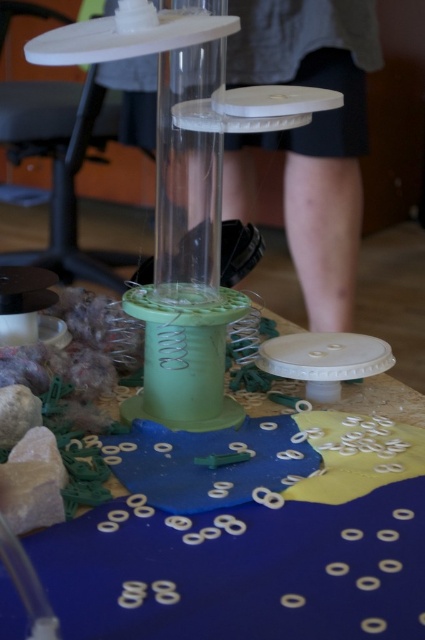
You are setting up an experiment and need to place a 3.5 inch long tool between the blue fabric at center and the transparent plastic glass vase at center. Can the tool fit between them without touching either object?

The blue fabric at center is 3.43 inches away from the transparent plastic glass vase at center. Since the tool is 3.5 inches long, it cannot fit between them without touching either object because the distance is slightly shorter than the tool.

You are setting up a display and have both the blue fabric at center and the transparent plastic glass vase at center. If you want to place them side by side on a shelf, which one should you place first to ensure they both fit?

The blue fabric at center has a larger width than the transparent plastic glass vase at center, so you should place the transparent plastic glass vase at center first to accommodate the wider blue fabric at center next.

You are setting up a display and need to place the blue fabric at center and the transparent plastic glass vase at center. According to the scene, which object should be placed closer to the viewer to match the image?

The blue fabric at center should be placed closer to the viewer because it is in front of the transparent plastic glass vase at center in the original image.